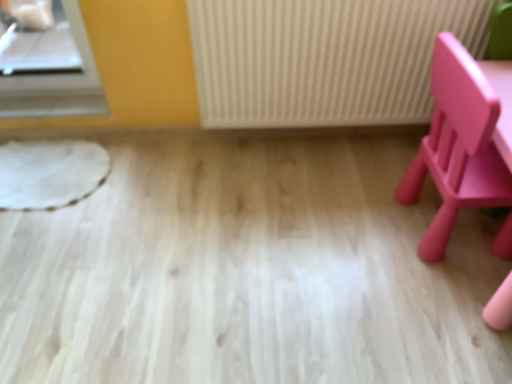
This screenshot has width=512, height=384. I want to click on vacant area that is in front of matte pink chair at right, so click(439, 309).